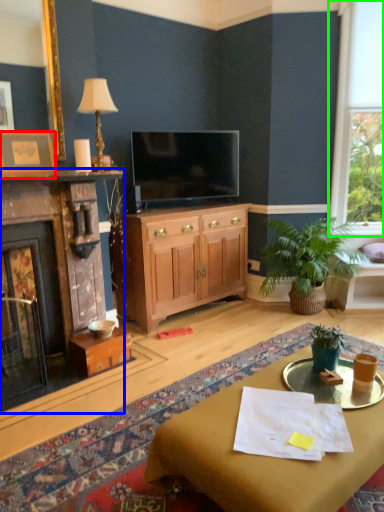
Question: Estimate the real-world distances between objects in this image. Which object is farther from picture frame (highlighted by a red box), fireplace (highlighted by a blue box) or window (highlighted by a green box)?

Choices:
 (A) fireplace
 (B) window

Answer: (B)